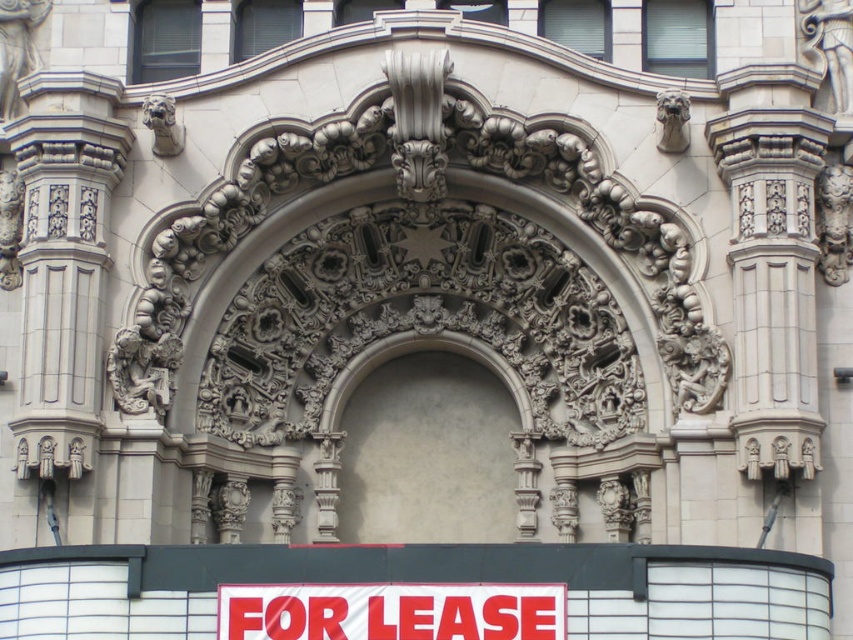
Is smooth beige arch at center shorter than white plastic sign at center?

No, smooth beige arch at center is not shorter than white plastic sign at center.

Can you confirm if smooth beige arch at center is wider than white plastic sign at center?

No, smooth beige arch at center is not wider than white plastic sign at center.

Is point (416, 449) farther from camera compared to point (277, 628)?

Yes, point (416, 449) is farther from viewer.

This screenshot has height=640, width=853. In order to click on smooth beige arch at center in this screenshot , I will do `click(428, 449)`.